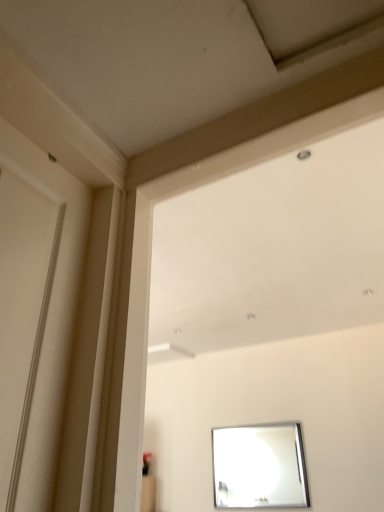
The width and height of the screenshot is (384, 512). What do you see at coordinates (259, 466) in the screenshot?
I see `silver metallic mirror at lower center` at bounding box center [259, 466].

In order to face silver metallic mirror at lower center, should I rotate leftwards or rightwards?

You should look right and rotate roughly 8.943 degrees.

Where is `silver metallic mirror at lower center`? This screenshot has width=384, height=512. silver metallic mirror at lower center is located at coordinates (259, 466).

Locate an element on the screen. This screenshot has height=512, width=384. white glossy window frame at upper center is located at coordinates (150, 256).

Describe the element at coordinates (150, 256) in the screenshot. I see `white glossy window frame at upper center` at that location.

What is the approximate height of white glossy window frame at upper center?

white glossy window frame at upper center is 93.70 centimeters tall.

Where is `silver metallic mirror at lower center`? silver metallic mirror at lower center is located at coordinates (259, 466).

Is white glossy window frame at upper center to the left or to the right of silver metallic mirror at lower center in the image?

white glossy window frame at upper center is positioned on silver metallic mirror at lower center's left side.

Is white glossy window frame at upper center in front of or behind silver metallic mirror at lower center in the image?

Clearly, white glossy window frame at upper center is in front of silver metallic mirror at lower center.

Is point (138, 415) positioned after point (272, 442)?

No, (138, 415) is in front of (272, 442).

From the image's perspective, relative to silver metallic mirror at lower center, is white glossy window frame at upper center above or below?

white glossy window frame at upper center is above silver metallic mirror at lower center.

From a real-world perspective, is white glossy window frame at upper center located higher than silver metallic mirror at lower center?

Yes, from a real-world perspective, white glossy window frame at upper center is above silver metallic mirror at lower center.

Can you confirm if white glossy window frame at upper center is thinner than silver metallic mirror at lower center?

No.

Considering the relative sizes of white glossy window frame at upper center and silver metallic mirror at lower center in the image provided, is white glossy window frame at upper center taller than silver metallic mirror at lower center?

Correct, white glossy window frame at upper center is much taller as silver metallic mirror at lower center.

Considering the relative sizes of white glossy window frame at upper center and silver metallic mirror at lower center in the image provided, is white glossy window frame at upper center bigger than silver metallic mirror at lower center?

Correct, white glossy window frame at upper center is larger in size than silver metallic mirror at lower center.

Is white glossy window frame at upper center surrounding silver metallic mirror at lower center?

No, silver metallic mirror at lower center is not surrounded by white glossy window frame at upper center.

From the picture: Is white glossy window frame at upper center not near silver metallic mirror at lower center?

white glossy window frame at upper center is positioned a significant distance from silver metallic mirror at lower center.

Is white glossy window frame at upper center facing away from silver metallic mirror at lower center?

No.

What are the coordinates of `mirror behind the white glossy window frame at upper center` in the screenshot? It's located at (259, 466).

Looking at this image, which is more to the left, silver metallic mirror at lower center or white glossy window frame at upper center?

white glossy window frame at upper center is more to the left.

In the scene shown: Which is behind, silver metallic mirror at lower center or white glossy window frame at upper center?

Positioned behind is silver metallic mirror at lower center.

Does point (214, 486) come closer to viewer compared to point (251, 150)?

No.

Consider the image. From the image's perspective, between silver metallic mirror at lower center and white glossy window frame at upper center, which one is located above?

white glossy window frame at upper center, from the image's perspective.

From a real-world perspective, is silver metallic mirror at lower center positioned over white glossy window frame at upper center based on gravity?

No, from a real-world perspective, silver metallic mirror at lower center is not over white glossy window frame at upper center

Looking at their sizes, would you say silver metallic mirror at lower center is wider or thinner than white glossy window frame at upper center?

Considering their sizes, silver metallic mirror at lower center looks slimmer than white glossy window frame at upper center.

Considering the sizes of objects silver metallic mirror at lower center and white glossy window frame at upper center in the image provided, who is taller, silver metallic mirror at lower center or white glossy window frame at upper center?

white glossy window frame at upper center.

In terms of size, does silver metallic mirror at lower center appear bigger or smaller than white glossy window frame at upper center?

Clearly, silver metallic mirror at lower center is smaller in size than white glossy window frame at upper center.

From the picture: Is white glossy window frame at upper center a part of silver metallic mirror at lower center?

That's incorrect, white glossy window frame at upper center is not inside silver metallic mirror at lower center.

Does silver metallic mirror at lower center touch white glossy window frame at upper center?

silver metallic mirror at lower center and white glossy window frame at upper center are not in contact.

Is silver metallic mirror at lower center facing towards white glossy window frame at upper center?

Yes, silver metallic mirror at lower center is aimed at white glossy window frame at upper center.

Could you measure the distance between silver metallic mirror at lower center and white glossy window frame at upper center?

silver metallic mirror at lower center is 5.53 meters from white glossy window frame at upper center.

Locate an element on the screen. The width and height of the screenshot is (384, 512). window frame that appears in front of the silver metallic mirror at lower center is located at coordinates (150, 256).

In order to click on mirror on the right of the white glossy window frame at upper center in this screenshot , I will do `click(259, 466)`.

In order to click on window frame on the left of silver metallic mirror at lower center in this screenshot , I will do `click(150, 256)`.